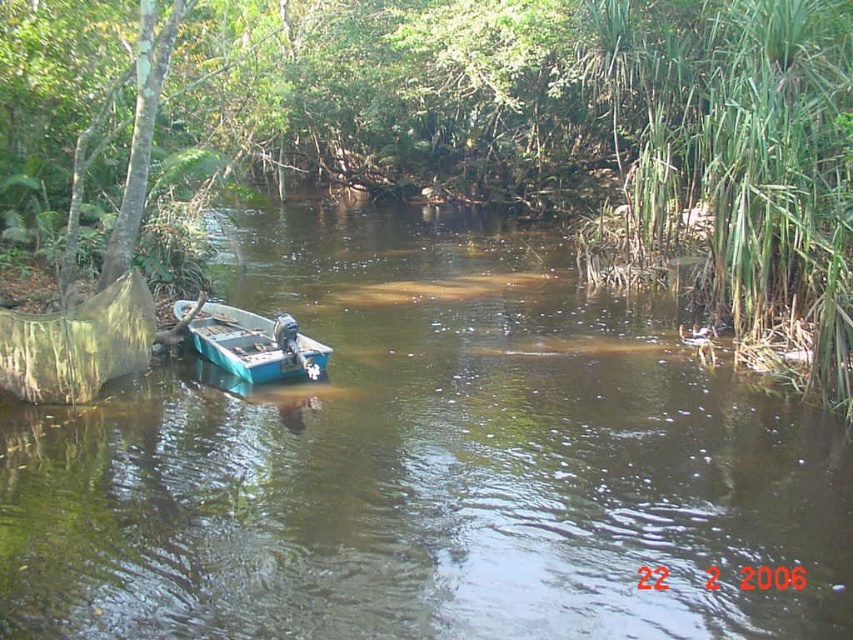
Question: Which object is closer to the camera taking this photo?

Choices:
 (A) brown matte boat at center
 (B) green leafy tree at left
 (C) teal plastic boat at center

Answer: (A)

Question: Is brown matte boat at center smaller than green leafy tree at left?

Choices:
 (A) yes
 (B) no

Answer: (A)

Question: Which of the following is the closest to the observer?

Choices:
 (A) green leafy tree at left
 (B) brown matte boat at center
 (C) teal plastic boat at center

Answer: (B)

Question: Is brown matte boat at center positioned behind teal plastic boat at center?

Choices:
 (A) yes
 (B) no

Answer: (B)

Question: Which of the following is the closest to the observer?

Choices:
 (A) brown matte boat at center
 (B) green leafy tree at left
 (C) teal plastic boat at center

Answer: (A)

Question: Is green leafy tree at left further to the viewer compared to teal plastic boat at center?

Choices:
 (A) no
 (B) yes

Answer: (A)